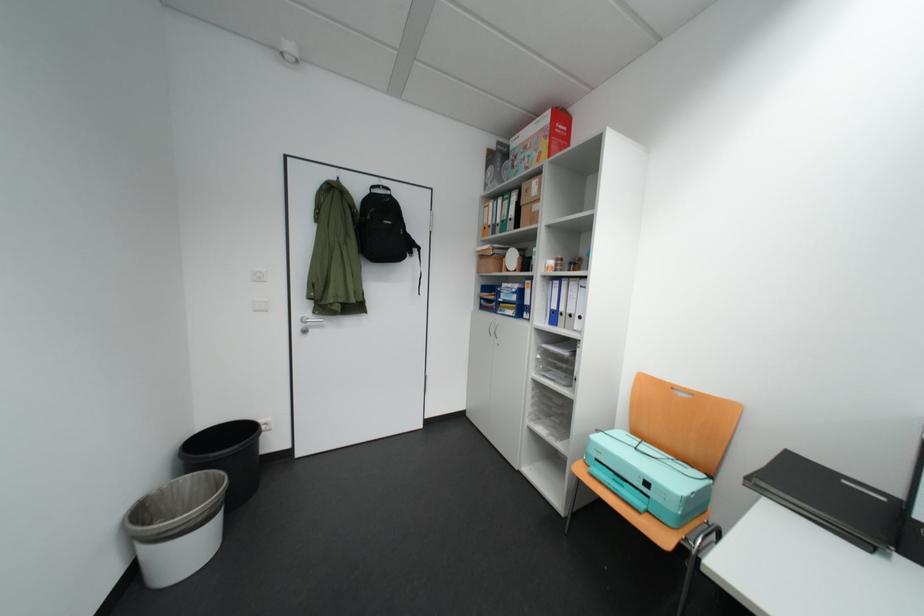
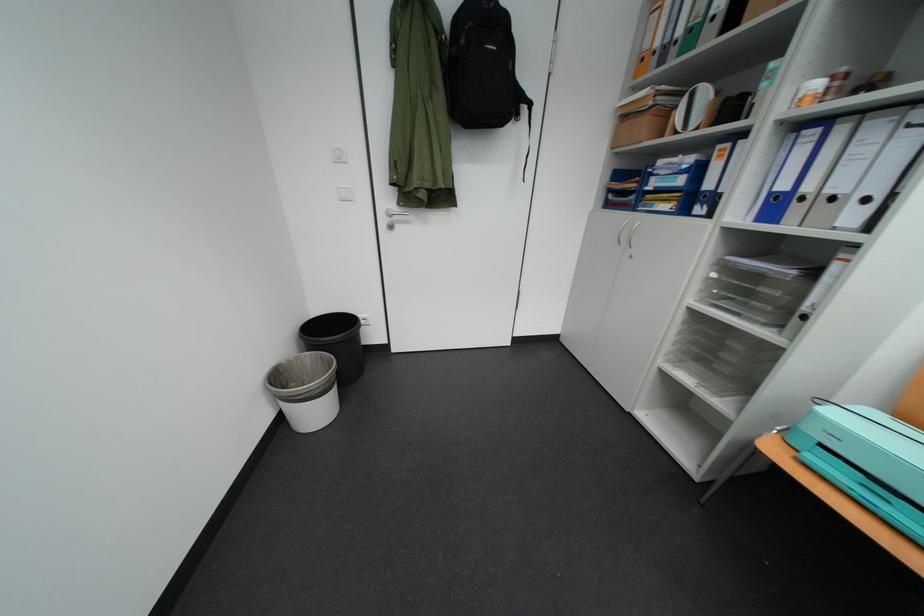
In the second image, find the point that corresponds to (x=591, y=472) in the first image.

(784, 451)